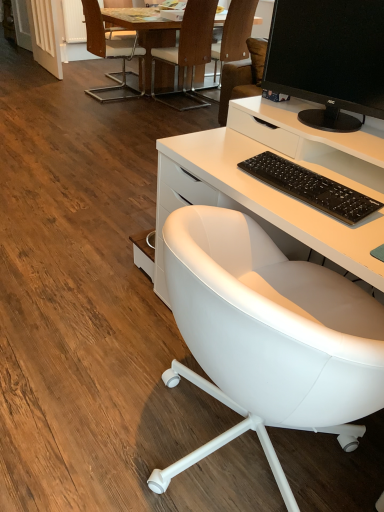
Question: In terms of height, does wooden chair at upper center, which is the 3th chair in back-to-front order, look taller or shorter compared to wooden chair at upper left, the second chair viewed from the back?

Choices:
 (A) short
 (B) tall

Answer: (B)

Question: Does point (165, 52) appear closer or farther from the camera than point (107, 88)?

Choices:
 (A) closer
 (B) farther

Answer: (A)

Question: Estimate the real-world distances between objects in this image. Which object is closer to the black matte keyboard at center?

Choices:
 (A) wooden chair at upper center, which appears as the second chair when viewed from the front
 (B) white leather chair at center, the fourth chair in the back-to-front sequence
 (C) brown leather chair at upper center, placed as the 1th chair when sorted from back to front
 (D) black glossy monitor at upper right
 (E) wooden table at upper center

Answer: (B)

Question: Which of these objects is positioned farthest from the white leather chair at center, which is the 1th chair from front to back?

Choices:
 (A) wooden chair at upper left, the second chair viewed from the back
 (B) wooden chair at upper center, which is the 3th chair in back-to-front order
 (C) black glossy monitor at upper right
 (D) brown leather chair at upper center, the fourth chair viewed from the front
 (E) wooden table at upper center

Answer: (A)